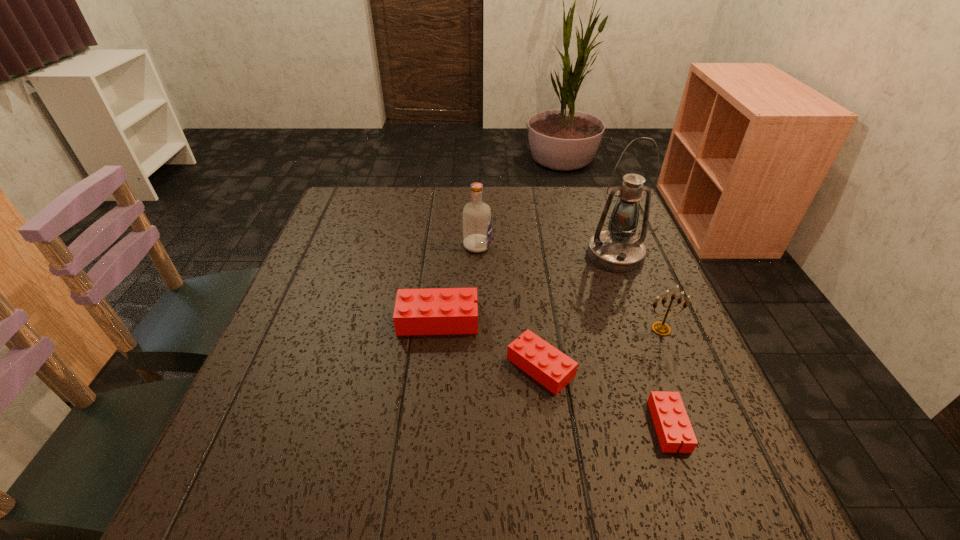
At what (x,y) coordinates should I click in order to perform the action: click on vacant space located 0.060m on the back of the second tallest Lego. Please return your answer as a coordinate pair (x, y). Looking at the image, I should click on (535, 321).

What are the coordinates of `blank area located on the back of the nearest object` in the screenshot? It's located at (620, 289).

You are a GUI agent. You are given a task and a screenshot of the screen. Output one action in this format:
    pyautogui.click(x=<x>, y=<y>)
    Task: Click on the vacant area situated 0.070m on the left of the tallest object
    This screenshot has width=960, height=540.
    Given the screenshot: What is the action you would take?
    pyautogui.click(x=561, y=254)

This screenshot has height=540, width=960. What are the coordinates of `vacant space situated on the label of the vodka` in the screenshot? It's located at (532, 246).

Find the location of a particular element. vacant space located 0.130m on the front of the fourth shortest object is located at coordinates (685, 387).

The image size is (960, 540). I want to click on object at the near edge, so click(670, 418).

The height and width of the screenshot is (540, 960). I want to click on Lego at the right edge, so click(x=670, y=418).

Find the location of a particular element. This screenshot has width=960, height=540. oil lamp that is at the right edge is located at coordinates (617, 249).

Where is `candelabrum that is at the right edge`? The height and width of the screenshot is (540, 960). candelabrum that is at the right edge is located at coordinates (661, 328).

Where is `object at the near right corner`? Image resolution: width=960 pixels, height=540 pixels. object at the near right corner is located at coordinates (670, 418).